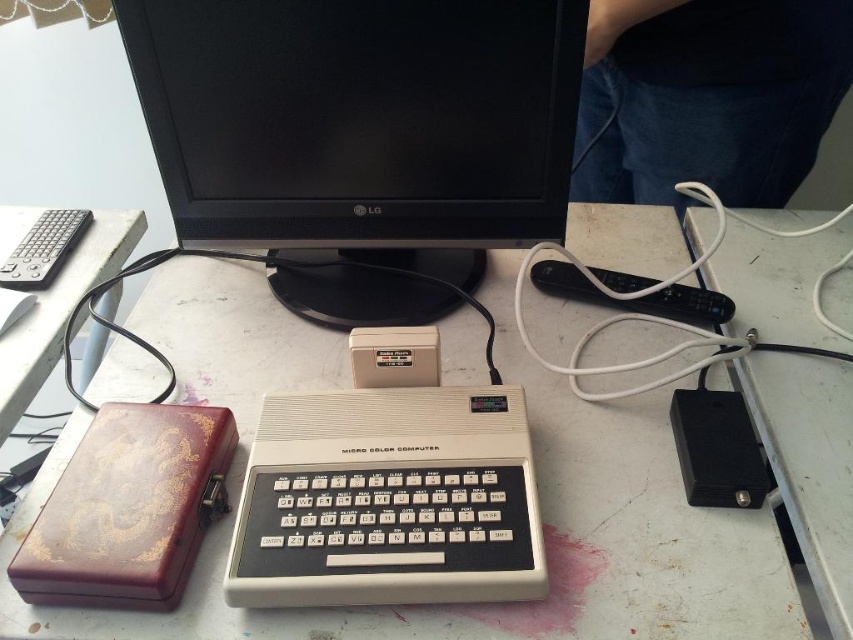
Is white plastic computer desk at center smaller than black plastic power supply at right?

Incorrect, white plastic computer desk at center is not smaller in size than black plastic power supply at right.

Can you confirm if white plastic computer desk at center is thinner than black plastic power supply at right?

In fact, white plastic computer desk at center might be wider than black plastic power supply at right.

The height and width of the screenshot is (640, 853). What do you see at coordinates (544, 540) in the screenshot?
I see `white plastic computer desk at center` at bounding box center [544, 540].

Locate an element on the screen. The width and height of the screenshot is (853, 640). white plastic computer desk at center is located at coordinates (544, 540).

Is white plastic computer desk at center shorter than wooden at left?

No.

Is point (167, 324) behind point (39, 324)?

No, (167, 324) is in front of (39, 324).

Where is `white plastic computer desk at center`? white plastic computer desk at center is located at coordinates (544, 540).

The image size is (853, 640). In order to click on white plastic computer desk at center in this screenshot , I will do `click(544, 540)`.

Is white plastic computer desk at center to the left of matte black monitor at center from the viewer's perspective?

Incorrect, white plastic computer desk at center is not on the left side of matte black monitor at center.

Which of these two, white plastic computer desk at center or matte black monitor at center, stands shorter?

Standing shorter between the two is matte black monitor at center.

What do you see at coordinates (544, 540) in the screenshot? I see `white plastic computer desk at center` at bounding box center [544, 540].

Identify the location of white plastic computer desk at center. This screenshot has width=853, height=640. (544, 540).